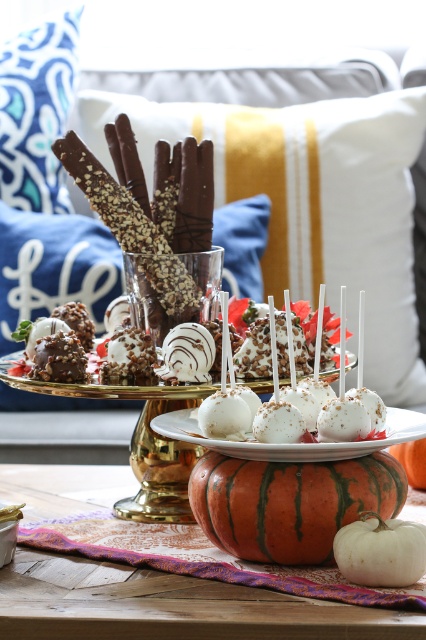
Which of these two, white cotton pillow at upper center or orange striped pumpkin at center, stands shorter?

With less height is orange striped pumpkin at center.

This screenshot has width=426, height=640. Describe the element at coordinates (310, 200) in the screenshot. I see `white cotton pillow at upper center` at that location.

Is point (388, 241) more distant than point (380, 513)?

Yes, it is behind point (380, 513).

Identify the location of white cotton pillow at upper center. This screenshot has height=640, width=426. (310, 200).

Image resolution: width=426 pixels, height=640 pixels. I want to click on orange pumpkin at center, so click(x=170, y=605).

Who is more forward, (20, 497) or (340, 417)?

Point (340, 417) is in front.

Does point (238, 604) lie in front of point (201, 422)?

Yes.

Image resolution: width=426 pixels, height=640 pixels. What are the coordinates of `orange pumpkin at center` in the screenshot? It's located at (170, 605).

Is white cotton pillow at upper center bigger than white matte pumpkin at lower center?

Yes, white cotton pillow at upper center is bigger than white matte pumpkin at lower center.

Does white cotton pillow at upper center have a lesser width compared to white matte pumpkin at lower center?

No.

Is point (348, 317) in front of point (382, 524)?

No, it is behind (382, 524).

Locate an element on the screen. The image size is (426, 640). white cotton pillow at upper center is located at coordinates coord(310,200).